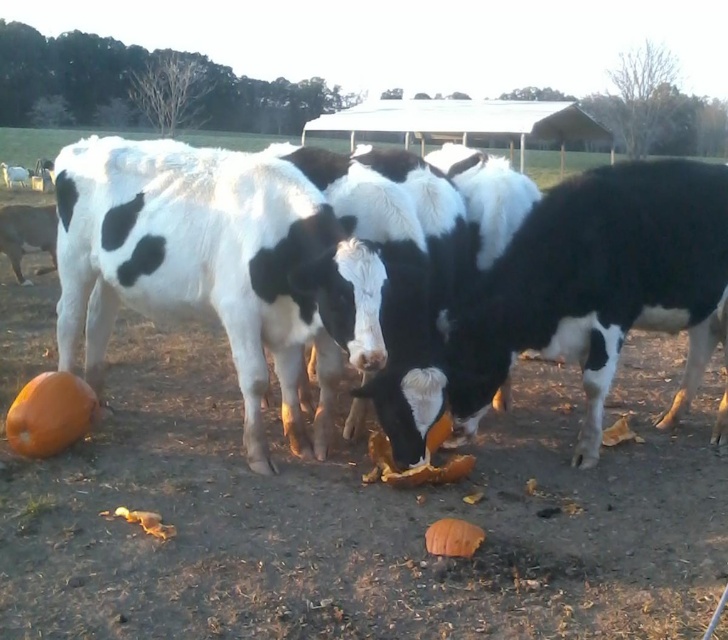
Measure the distance from black and white spotted cows at center to orange matte pumpkin at lower center.

A distance of 1.40 meters exists between black and white spotted cows at center and orange matte pumpkin at lower center.

Who is lower down, black and white spotted cows at center or orange matte pumpkin at lower center?

orange matte pumpkin at lower center is below.

Does point (676, 172) lie in front of point (432, 554)?

No, it is behind (432, 554).

The image size is (728, 640). I want to click on black and white spotted cows at center, so click(x=405, y=404).

Which is above, black and white spotted cows at center or orange matte pumpkin at lower left?

black and white spotted cows at center

Who is more forward, (68,182) or (52,419)?

Positioned in front is point (52,419).

Who is more distant from viewer, [689,392] or [47,376]?

Point [689,392]

I want to click on black and white spotted cows at center, so click(405, 404).

Is orange matte pumpkin at lower left to the right of orange matte pumpkin at lower center from the viewer's perspective?

Incorrect, orange matte pumpkin at lower left is not on the right side of orange matte pumpkin at lower center.

Identify the location of orange matte pumpkin at lower left. (50, 413).

The width and height of the screenshot is (728, 640). In order to click on orange matte pumpkin at lower left in this screenshot , I will do `click(50, 413)`.